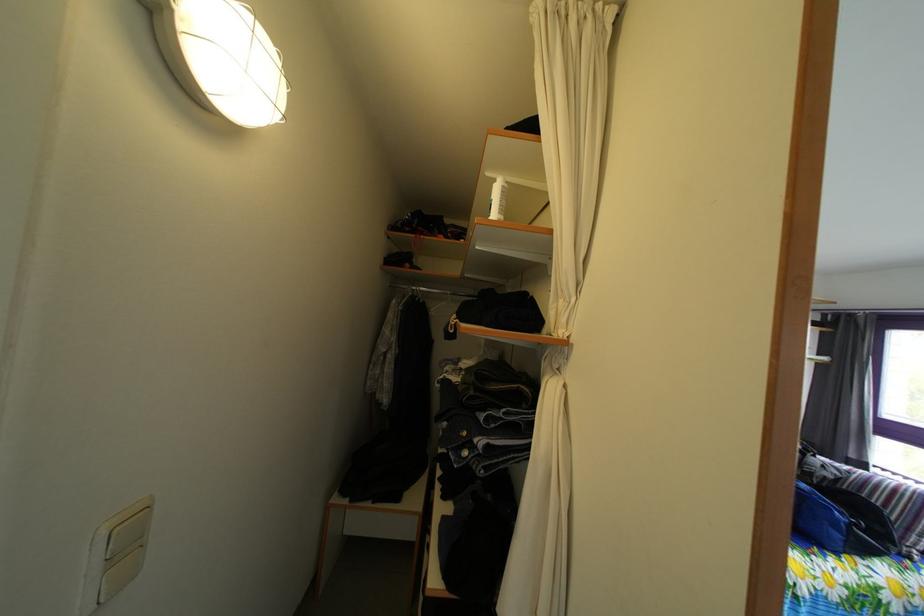
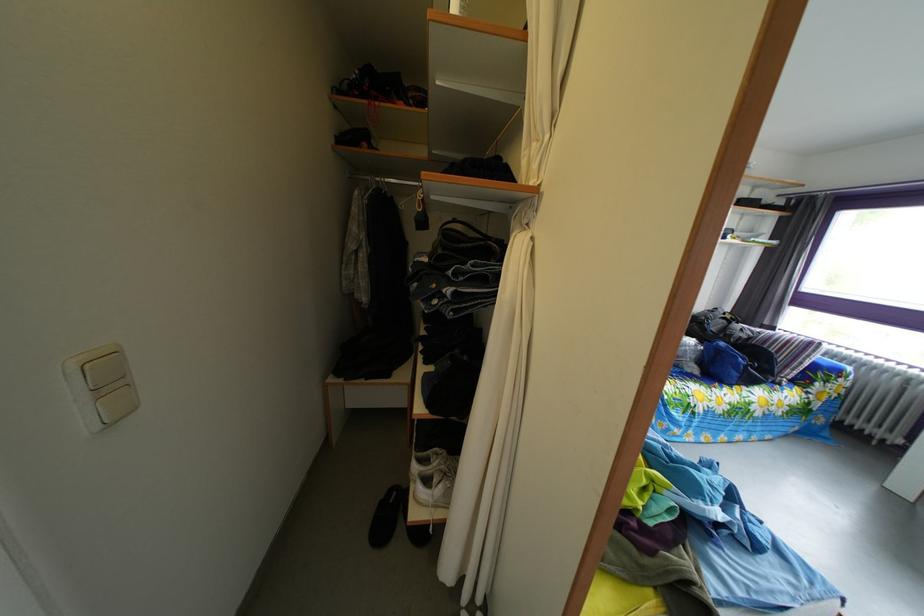
Question: The first image is from the beginning of the video and the second image is from the end. How did the camera likely rotate when shooting the video?

Choices:
 (A) Left
 (B) Right
 (C) Up
 (D) Down

Answer: (D)